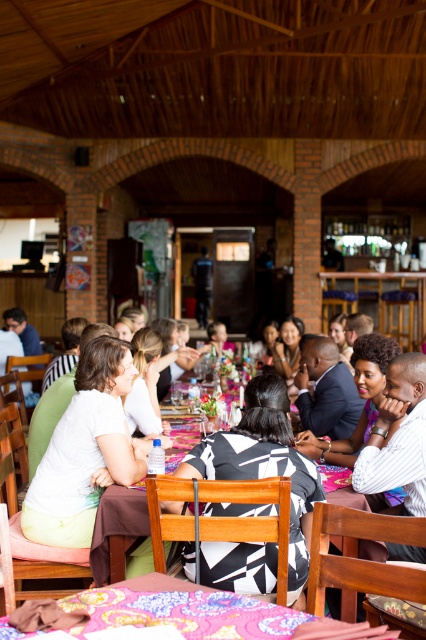
Can you confirm if floral fabric tablecloth at lower center is thinner than wooden table at center?

In fact, floral fabric tablecloth at lower center might be wider than wooden table at center.

Does floral fabric tablecloth at lower center appear under wooden table at center?

Yes.

Who is more forward, (x=268, y=634) or (x=259, y=429)?

Point (x=268, y=634) is more forward.

Where is `floral fabric tablecloth at lower center`? floral fabric tablecloth at lower center is located at coordinates coord(183,611).